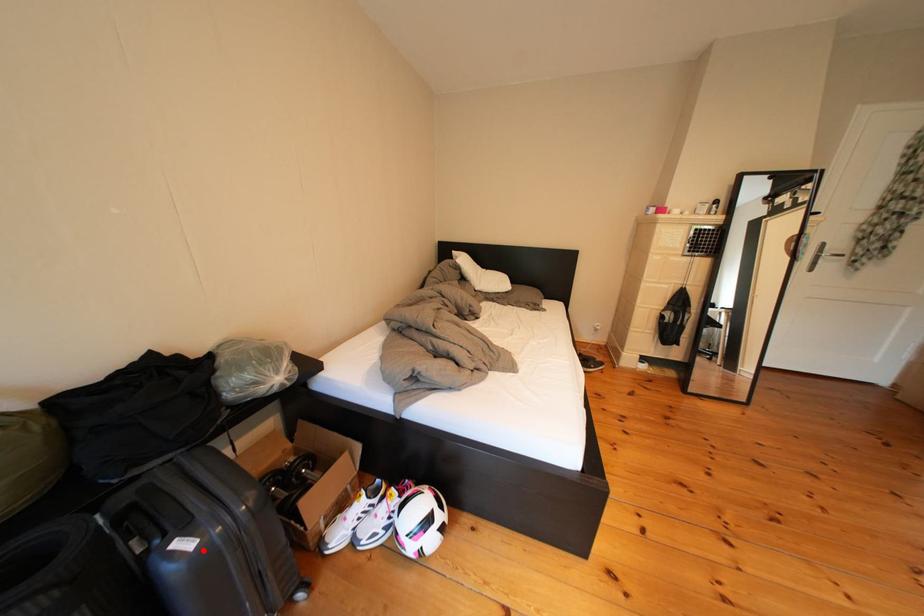
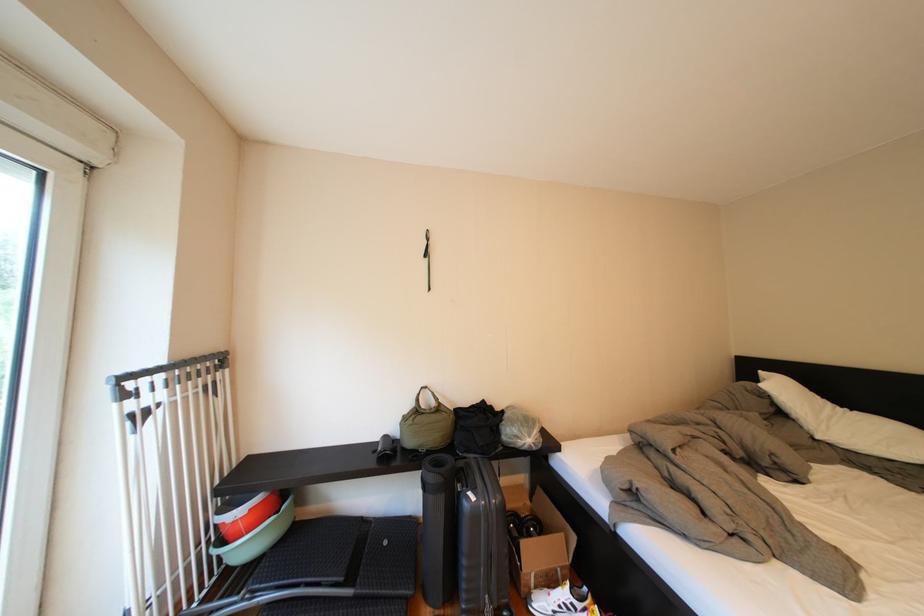
The point at the highlighted location is marked in the first image. Where is the corresponding point in the second image?

(487, 503)